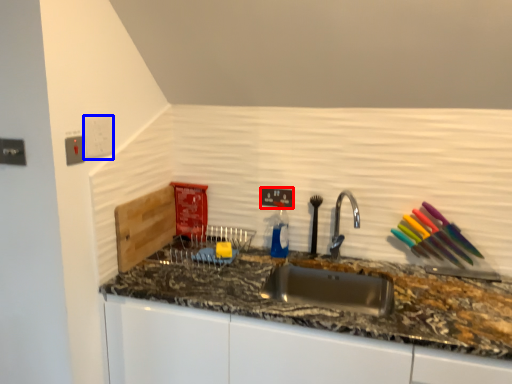
Question: Among these objects, which one is nearest to the camera, electric outlet (highlighted by a red box) or electric outlet (highlighted by a blue box)?

Choices:
 (A) electric outlet
 (B) electric outlet

Answer: (B)